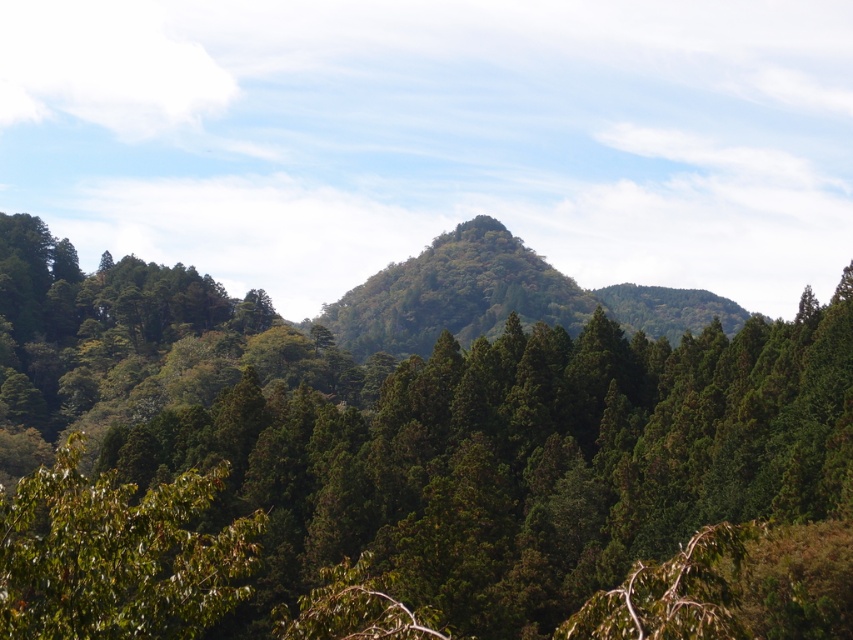
You are standing in the lush forest landscape described. You see a point marked at coordinates (x=433, y=435). What object is located at this point?

The point at coordinates (x=433, y=435) marks a green textured tree at center.

You are standing in the lush landscape and want to take a photo of the green textured tree at center. Where should you position yourself relative to the tree to ensure it appears in the center of your camera frame?

Since the 2D location of the green textured tree at center is at point (433, 435), you should position yourself directly in front of the tree, aligning it with the center of your camera frame to capture it at the specified coordinates.

You are a hiker navigating through the forest depicted in the image. You spot two points marked on your map at coordinates point (515, 611) and point (657, 321). Which point is closer to you as you stand in the foreground of the scene?

Point (515, 611) is in front of point (657, 321), so it is closer to you.